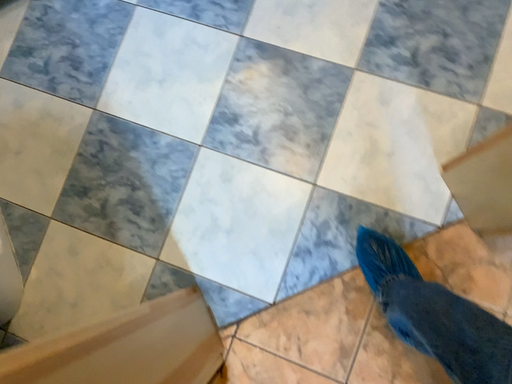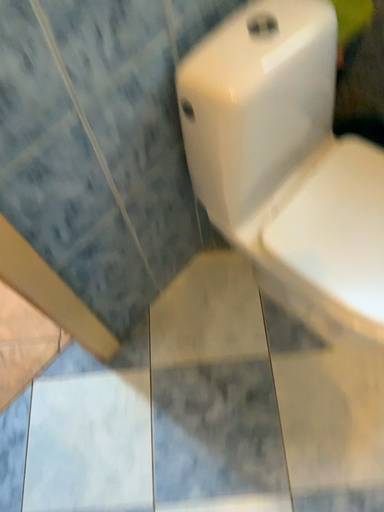
Question: Which way did the camera rotate in the video?

Choices:
 (A) rotated right
 (B) rotated left

Answer: (B)